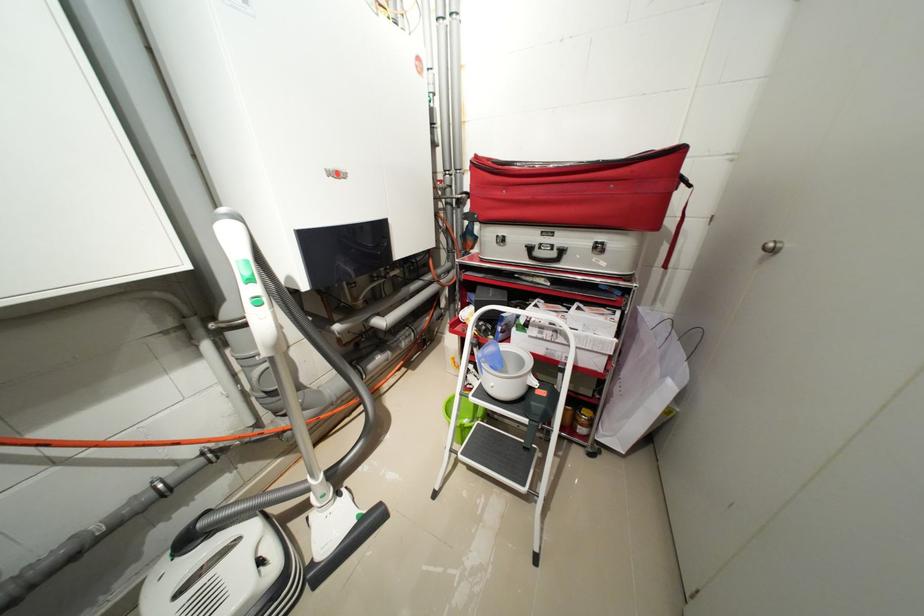
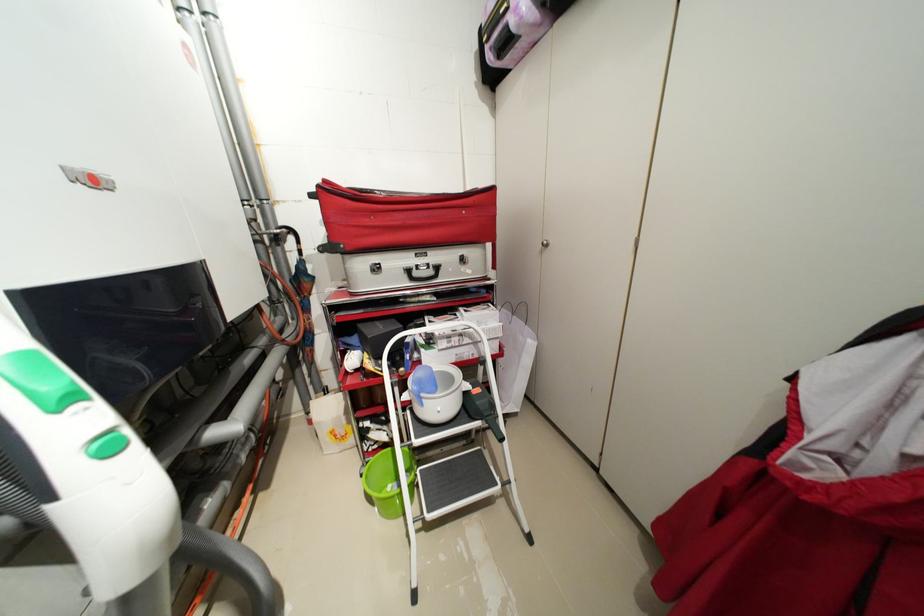
Find the pixel in the second image that matches (x=608, y=370) in the first image.

(505, 352)